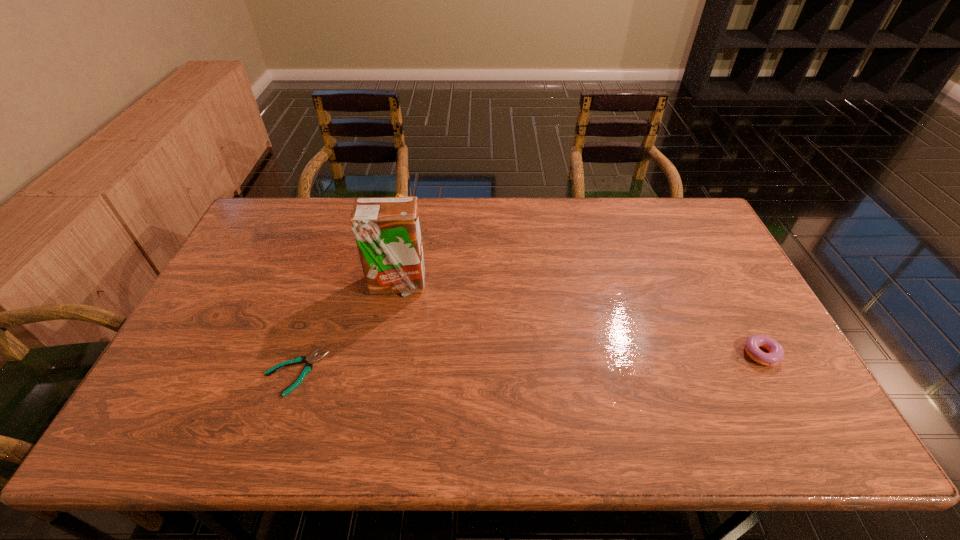
The image size is (960, 540). I want to click on free space on the desktop that is between the leftmost object and the rightmost object and is positioned on the front-facing side of the farthest object, so click(464, 366).

The width and height of the screenshot is (960, 540). In order to click on vacant space on the desktop that is between the pliers and the second shortest object and is positioned on the straw side of the third nearest object in this screenshot , I will do `click(492, 365)`.